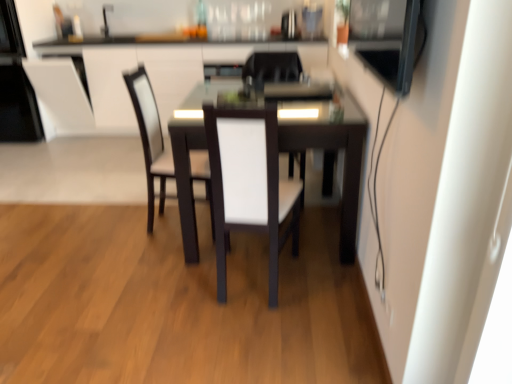
At what (x,y) coordinates should I click in order to perform the action: click on free space to the left of white fabric chair at center, marked as the first chair in a front-to-back arrangement. Please return your answer as a coordinate pair (x, y). Looking at the image, I should click on (166, 281).